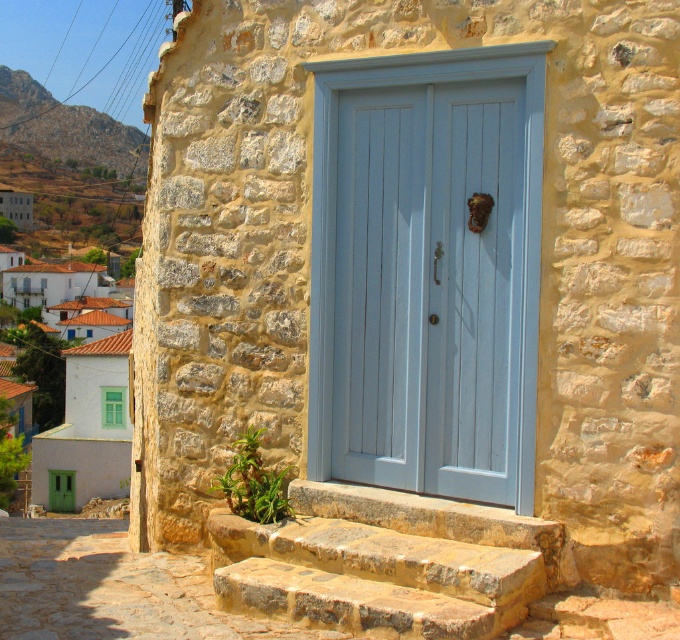
Which is in front, point (107, 372) or point (37, 132)?

Point (107, 372)

Is the position of white painted wall at left less distant than that of rustic stone hillside at upper left?

Yes, it is.

Between point (88, 488) and point (54, 116), which one is positioned in front?

Point (88, 488)

I want to click on white painted wall at left, so click(80, 380).

Is light blue wooden door at center to the right of white painted wall at left from the viewer's perspective?

Yes, light blue wooden door at center is to the right of white painted wall at left.

Where is `light blue wooden door at center`? light blue wooden door at center is located at coordinates (426, 272).

Between point (405, 204) and point (37, 380), which one is positioned in front?

Point (405, 204) is more forward.

Locate an element on the screen. light blue wooden door at center is located at coordinates (426, 272).

Looking at this image, does light blue wooden door at center appear over natural stone steps at center?

Yes, light blue wooden door at center is above natural stone steps at center.

Is light blue wooden door at center wider than natural stone steps at center?

Incorrect, light blue wooden door at center's width does not surpass natural stone steps at center's.

Looking at this image, measure the distance between point (x=388, y=154) and camera.

They are 23.38 feet apart.

Where is `light blue wooden door at center`? light blue wooden door at center is located at coordinates (426, 272).